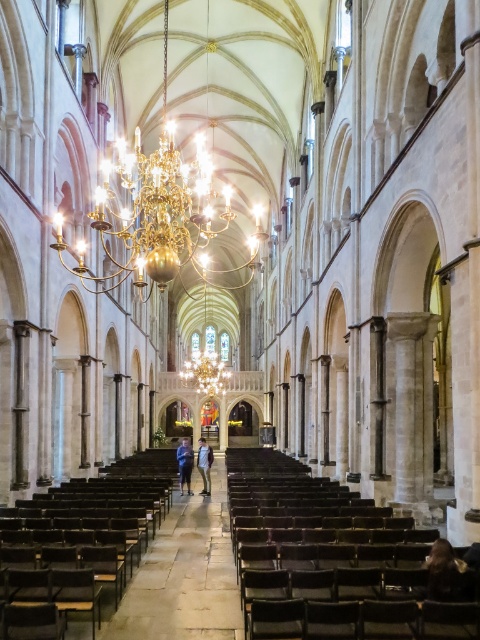
Between brown wooden aisle at center and blue denim jeans at center, which one appears on the right side from the viewer's perspective?

From the viewer's perspective, brown wooden aisle at center appears more on the right side.

Does brown wooden aisle at center appear on the left side of blue denim jeans at center?

No, brown wooden aisle at center is not to the left of blue denim jeans at center.

At what (x,y) coordinates should I click in order to perform the action: click on brown wooden aisle at center. Please return your answer as a coordinate pair (x, y). Looking at the image, I should click on (184, 573).

Find the location of a particular element. brown wooden aisle at center is located at coordinates (184, 573).

Image resolution: width=480 pixels, height=640 pixels. Describe the element at coordinates (184, 573) in the screenshot. I see `brown wooden aisle at center` at that location.

Is brown wooden aisle at center in front of dark brown leather jacket at lower right?

That is False.

Is point (152, 604) more distant than point (439, 554)?

Yes.

Locate an element on the screen. This screenshot has height=640, width=480. brown wooden aisle at center is located at coordinates (184, 573).

Between black leather chair at center and gold metallic chandelier at center, which one is positioned lower?

black leather chair at center

Which is above, black leather chair at center or gold metallic chandelier at center?

gold metallic chandelier at center is higher up.

Identify the location of black leather chair at center. (331, 566).